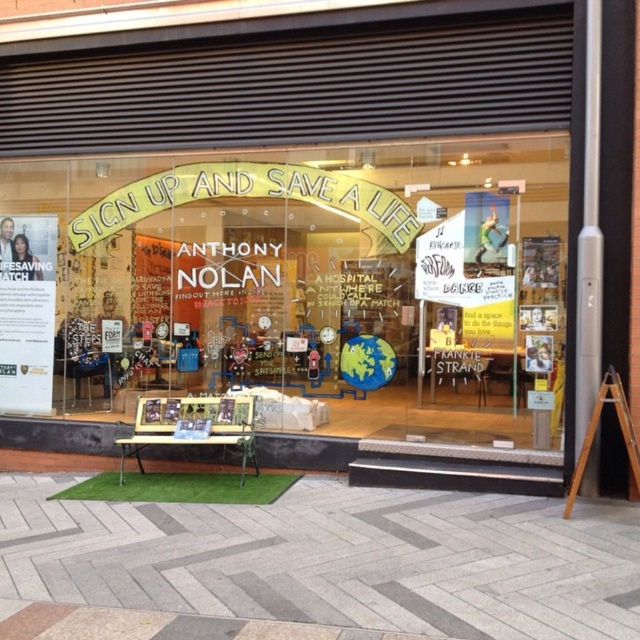
You are standing in front of the shop and looking at the window display. There are two points marked on the window at coordinates point (488, 211) and point (618, 403). Which point is closer to you?

Point (488, 211) is closer to you because it is further to the viewer than point (618, 403).

You are a customer entering the shop and notice the matte glass sign at center and the wooden sign at lower right. Which sign takes up more space in the storefront?

The wooden sign at lower right takes up more space than the matte glass sign at center because the matte glass sign at center occupies less space than wooden sign at lower right.

You are a customer standing in front of the shop. You want to read both the matte glass sign at center and the wooden sign at lower right. Which sign should you look at first to read them in the correct order from top to bottom?

The matte glass sign at center is located above the wooden sign at lower right, so you should look at the matte glass sign at center first, then the wooden sign at lower right.